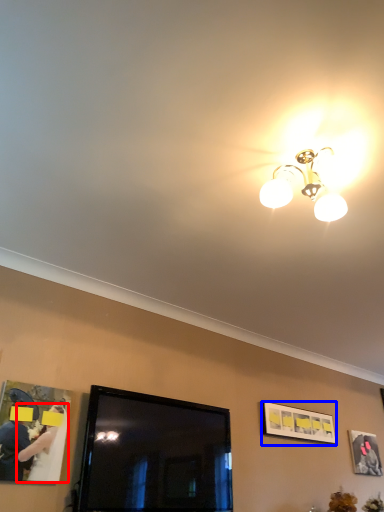
Question: Among these objects, which one is nearest to the camera, woman (highlighted by a red box) or picture frame (highlighted by a blue box)?

Choices:
 (A) woman
 (B) picture frame

Answer: (A)